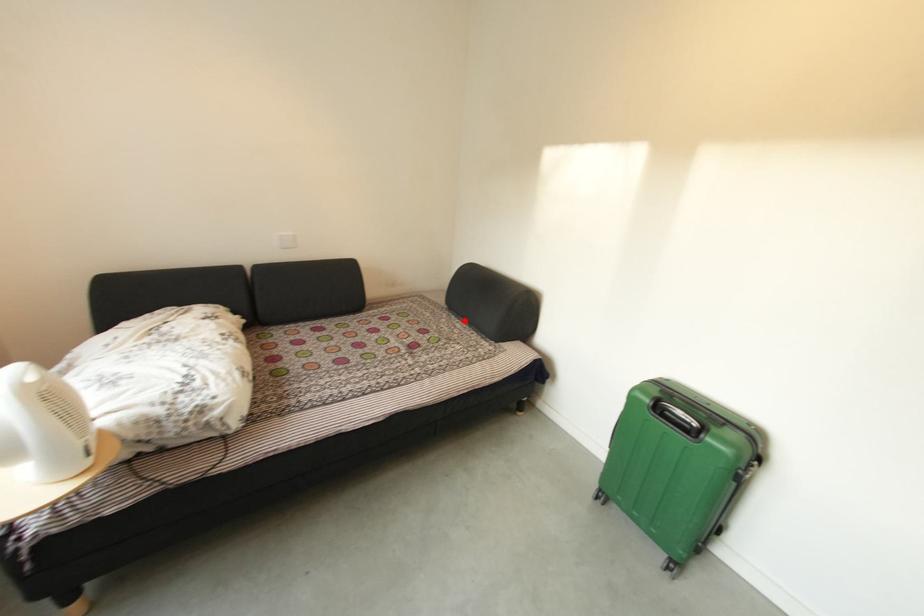
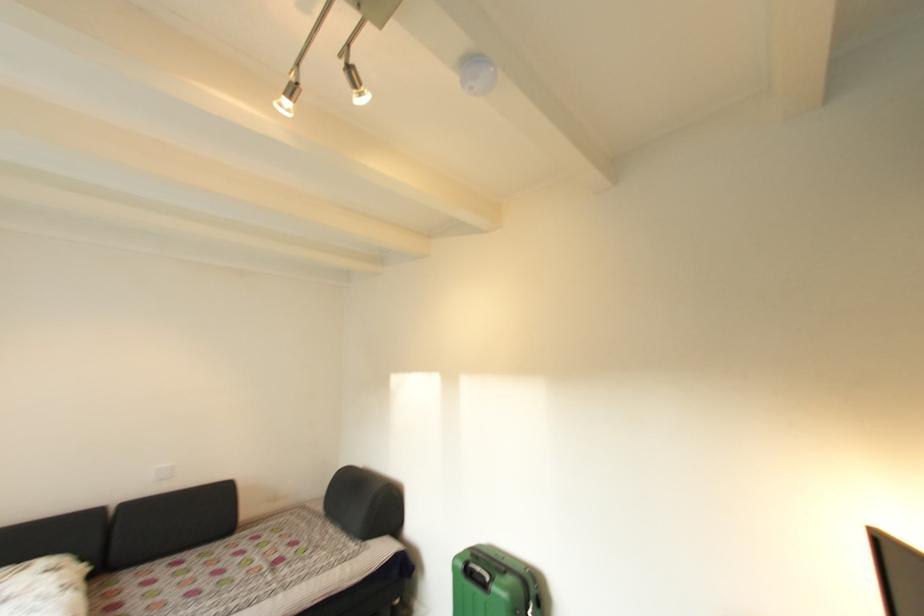
Locate, in the second image, the point that corresponds to the highlighted location in the first image.

(341, 525)